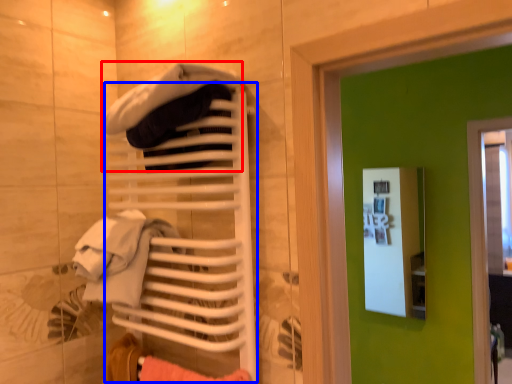
Question: Which object is further to the camera taking this photo, clothing (highlighted by a red box) or closet (highlighted by a blue box)?

Choices:
 (A) clothing
 (B) closet

Answer: (B)